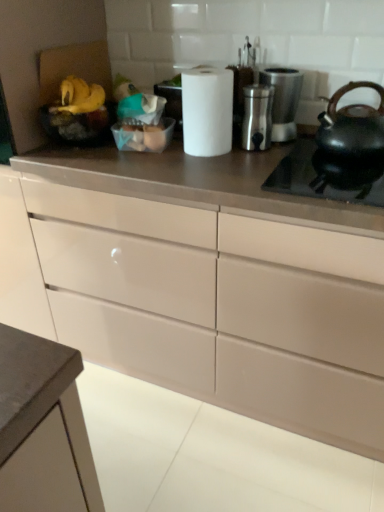
Find the location of `vacant area in front of white matte paper towel at center`. vacant area in front of white matte paper towel at center is located at coordinates (208, 168).